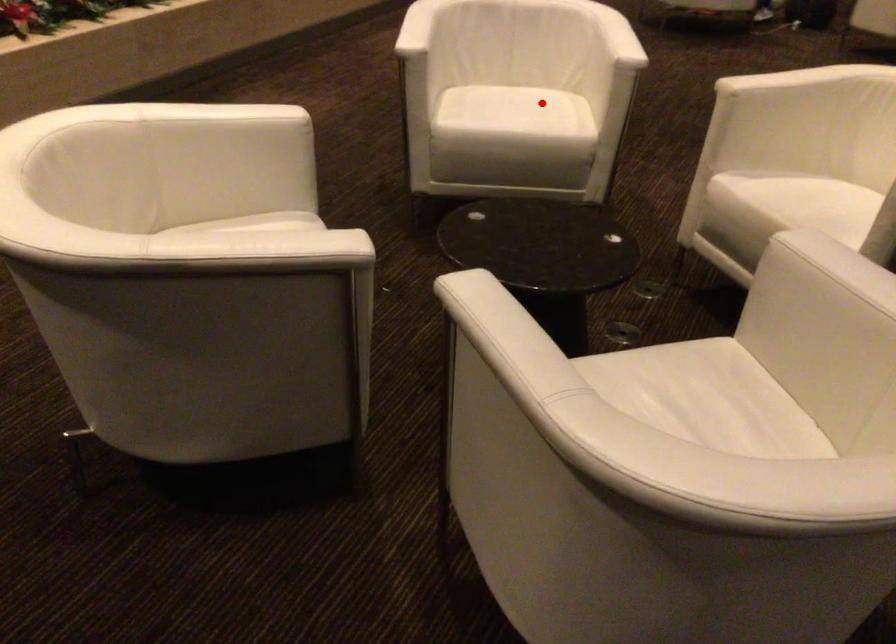
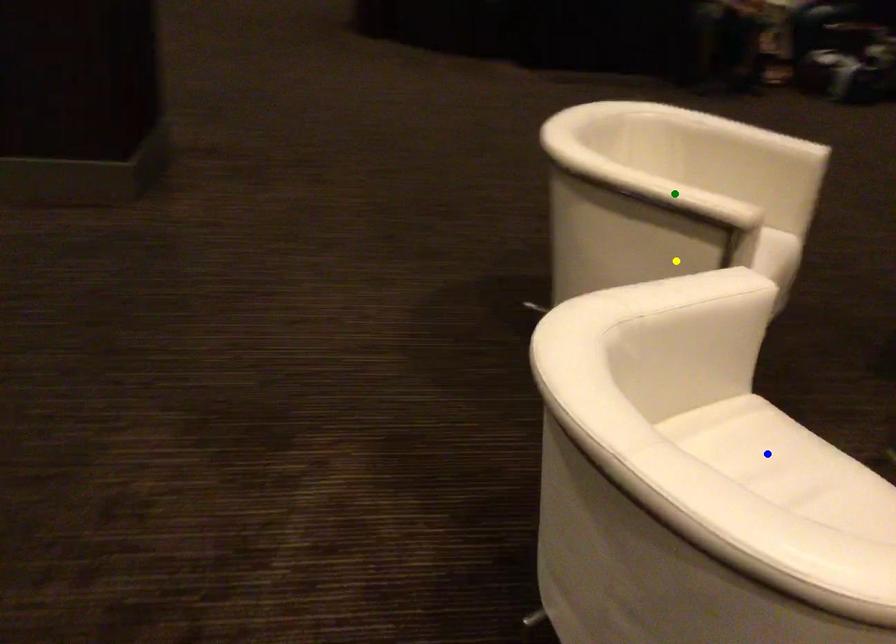
Question: I am providing you with two images of the same scene from different viewpoints. A red point is marked on the first image. You are given multiple points on the second image. Can you choose the point in image 2 that corresponds to the point in image 1?

Choices:
 (A) green point
 (B) blue point
 (C) yellow point

Answer: (B)